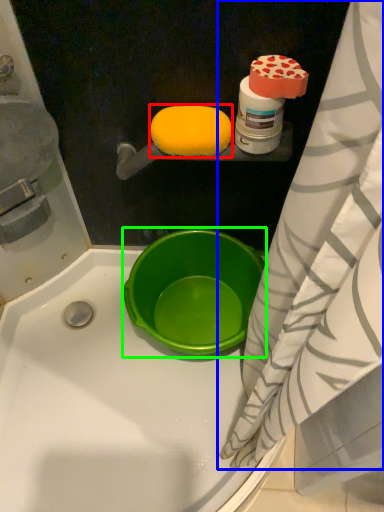
Question: Which object is positioned farthest from food (highlighted by a red box)? Select from curtain (highlighted by a blue box) and basin (highlighted by a green box).

Choices:
 (A) curtain
 (B) basin

Answer: (B)